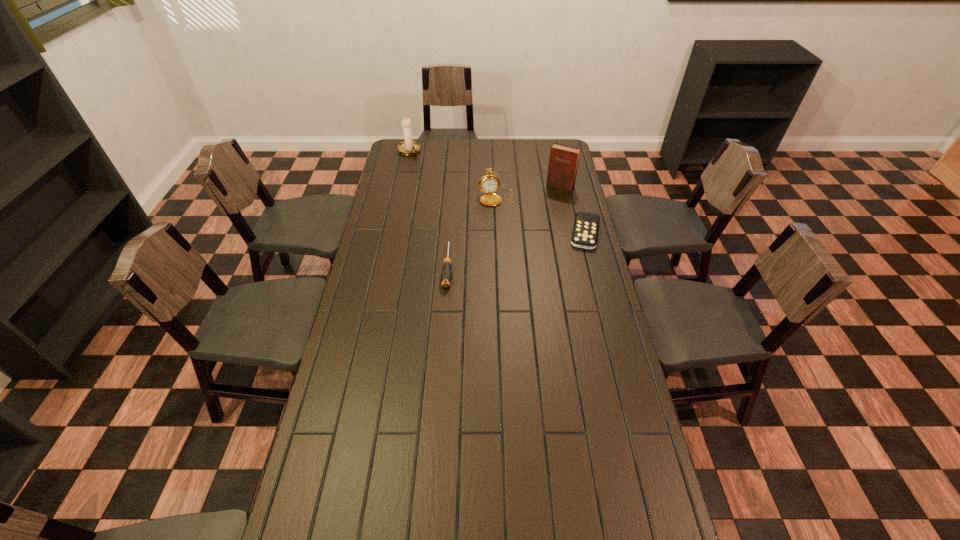
Where is `vacant space in between the shortest object and the screwdriver`? The image size is (960, 540). vacant space in between the shortest object and the screwdriver is located at coordinates (516, 249).

Find the location of `vacant space that is in between the third object from left to right and the diary`. vacant space that is in between the third object from left to right and the diary is located at coordinates (529, 192).

You are a GUI agent. You are given a task and a screenshot of the screen. Output one action in this format:
    pyautogui.click(x=<x>, y=<y>)
    Task: Click on the free space between the third object from left to right and the leftmost object
    
    Given the screenshot: What is the action you would take?
    pyautogui.click(x=453, y=174)

You are a GUI agent. You are given a task and a screenshot of the screen. Output one action in this format:
    pyautogui.click(x=<x>, y=<y>)
    Task: Click on the free space that is in between the second shortest object and the shortest object
    Image resolution: width=960 pixels, height=540 pixels.
    Given the screenshot: What is the action you would take?
    pyautogui.click(x=516, y=249)

Identify the location of empty location between the third tallest object and the candle holder. The image size is (960, 540). (453, 174).

Image resolution: width=960 pixels, height=540 pixels. I want to click on free spot between the diary and the second object from left to right, so click(x=504, y=226).

Find the location of `empty space between the remote control and the candle holder`. empty space between the remote control and the candle holder is located at coordinates (497, 192).

In order to click on empty location between the third shortest object and the diary in this screenshot , I will do `click(529, 192)`.

This screenshot has height=540, width=960. What are the coordinates of `empty space between the diary and the third object from left to right` in the screenshot? It's located at (529, 192).

The width and height of the screenshot is (960, 540). In order to click on the third closest object relative to the diary in this screenshot , I will do `click(446, 276)`.